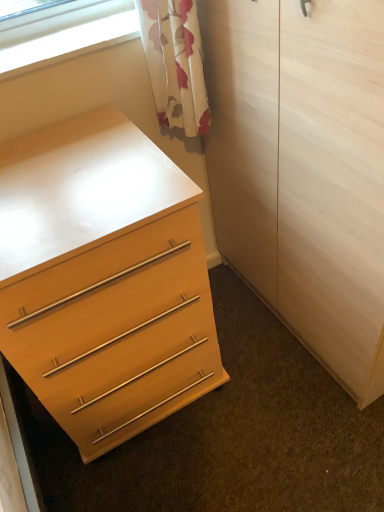
Where is `free space on the front side of matte wood chest of drawers at lower left`? free space on the front side of matte wood chest of drawers at lower left is located at coordinates coord(166,473).